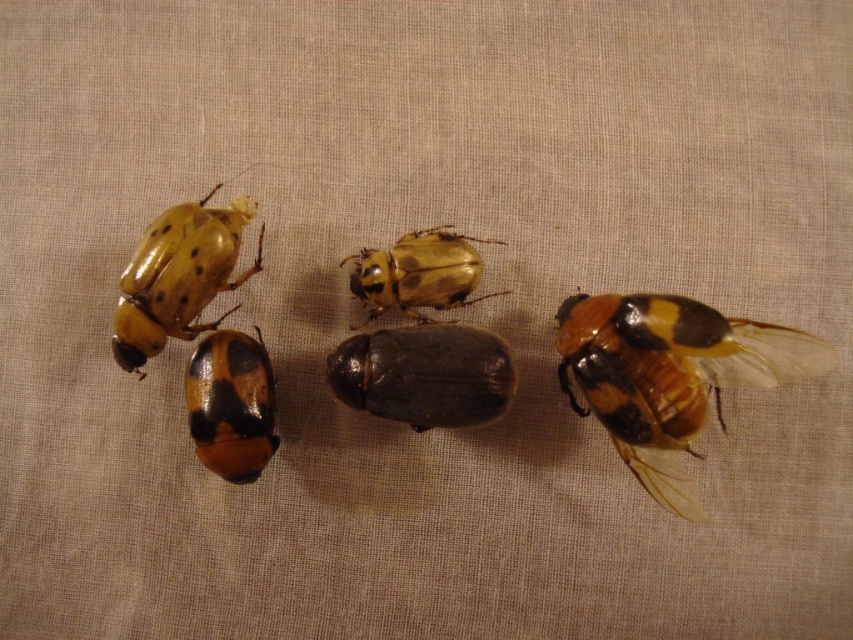
You are standing in front of the image and want to touch the two points labeled point (x=693, y=404) and point (x=236, y=428). Which point is closer to your hand?

Point (x=693, y=404) is closer to the camera than point (x=236, y=428), so it is closer to your hand.

You are an entomologist examining two beetles on a beige fabric. You have a matte yellow beetle at upper left and a matte yellow beetle at center. Which beetle is taller?

The matte yellow beetle at upper left is much taller than the matte yellow beetle at center.